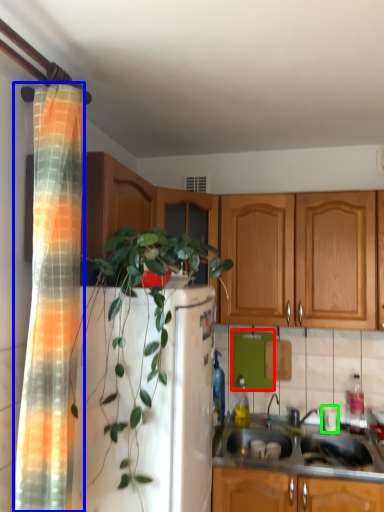
Question: Which object is the farthest from appliance (highlighted by a red box)? Choose among these: shower curtain (highlighted by a blue box) or appliance (highlighted by a green box).

Choices:
 (A) shower curtain
 (B) appliance

Answer: (A)